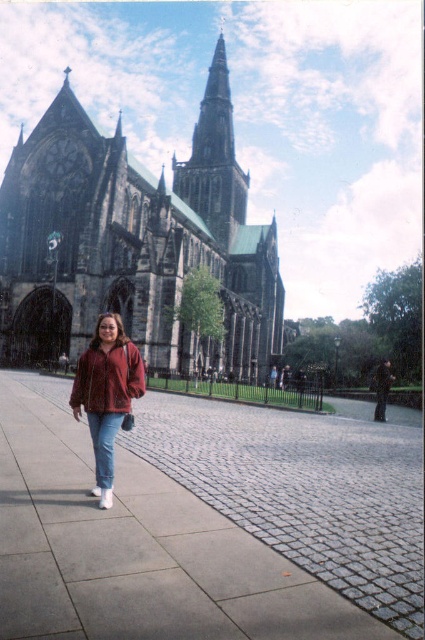
Question: Is dark gray stone church at center closer to camera compared to matte red jacket at center?

Choices:
 (A) no
 (B) yes

Answer: (A)

Question: Which of the following is the farthest from the observer?

Choices:
 (A) dark gray stone church at center
 (B) matte red jacket at center
 (C) gray stone pavement at center

Answer: (A)

Question: Can you confirm if dark gray stone church at center is positioned above dark gray stone spire at center?

Choices:
 (A) yes
 (B) no

Answer: (B)

Question: Which point is farther from the camera taking this photo?

Choices:
 (A) (116, 413)
 (B) (198, 141)

Answer: (B)

Question: Does dark gray stone spire at center appear over blue denim jeans at lower left?

Choices:
 (A) yes
 (B) no

Answer: (A)

Question: Which object appears closest to the camera in this image?

Choices:
 (A) dark gray stone spire at center
 (B) gray stone pavement at center

Answer: (B)